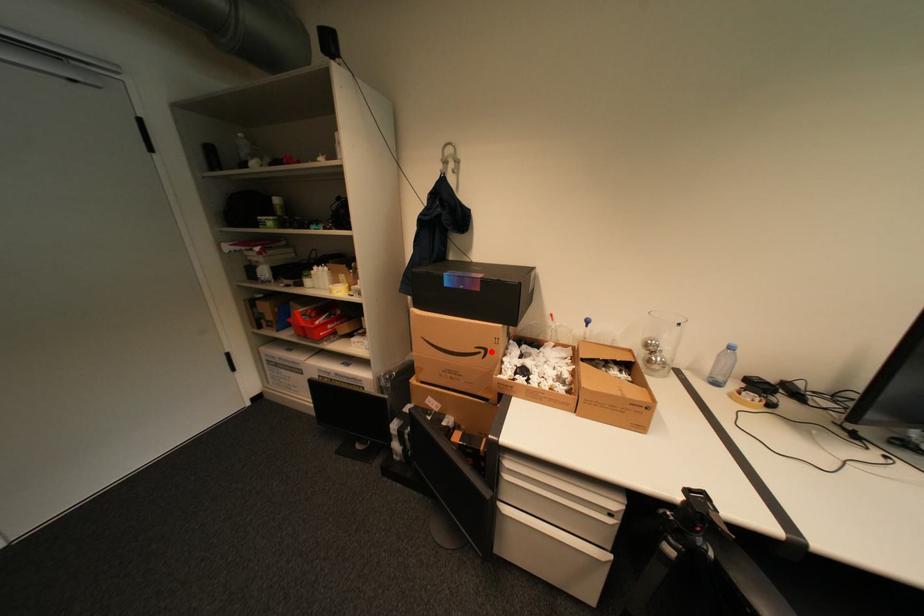
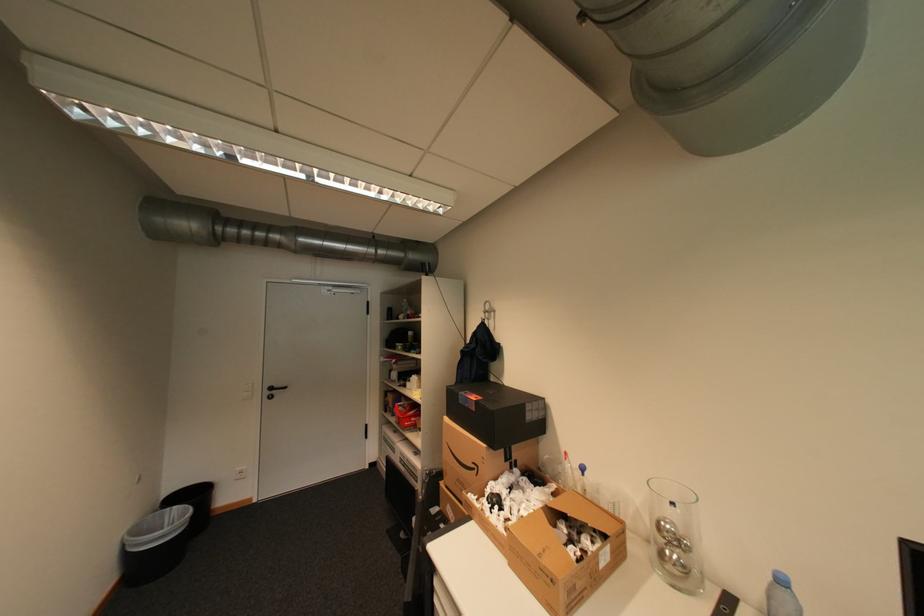
Locate, in the second image, the point that corresponds to the highlighted location in the first image.

(484, 468)